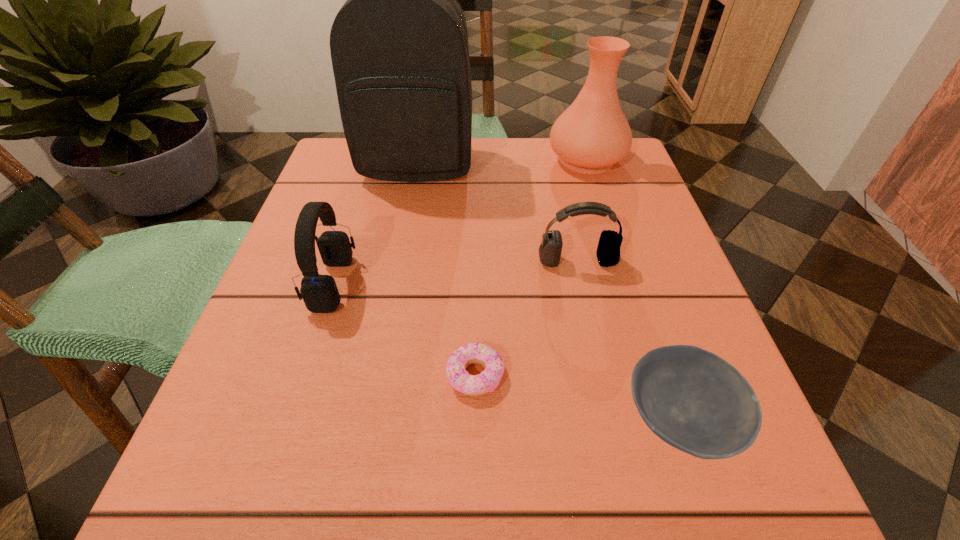
At what (x,y) coordinates should I click in order to perform the action: click on free space in the image that satisfies the following two spatial constraints: 1. on the front-facing side of the backpack; 2. on the headband of the third tallest object. Please return your answer as a coordinate pair (x, y). The height and width of the screenshot is (540, 960). Looking at the image, I should click on (396, 284).

This screenshot has width=960, height=540. In order to click on vacant space that satisfies the following two spatial constraints: 1. on the headband of the shortest object; 2. on the right side of the left headset in this screenshot , I will do `click(304, 375)`.